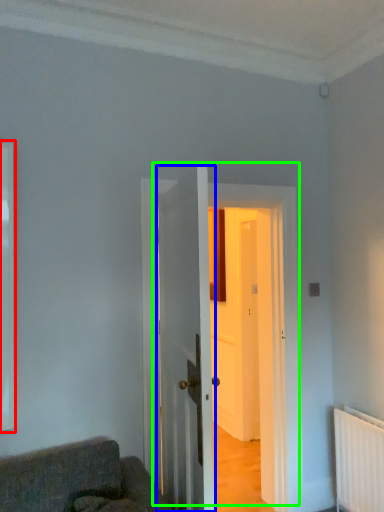
Question: Which object is the farthest from window (highlighted by a red box)? Choose among these: door (highlighted by a blue box) or door (highlighted by a green box).

Choices:
 (A) door
 (B) door

Answer: (A)